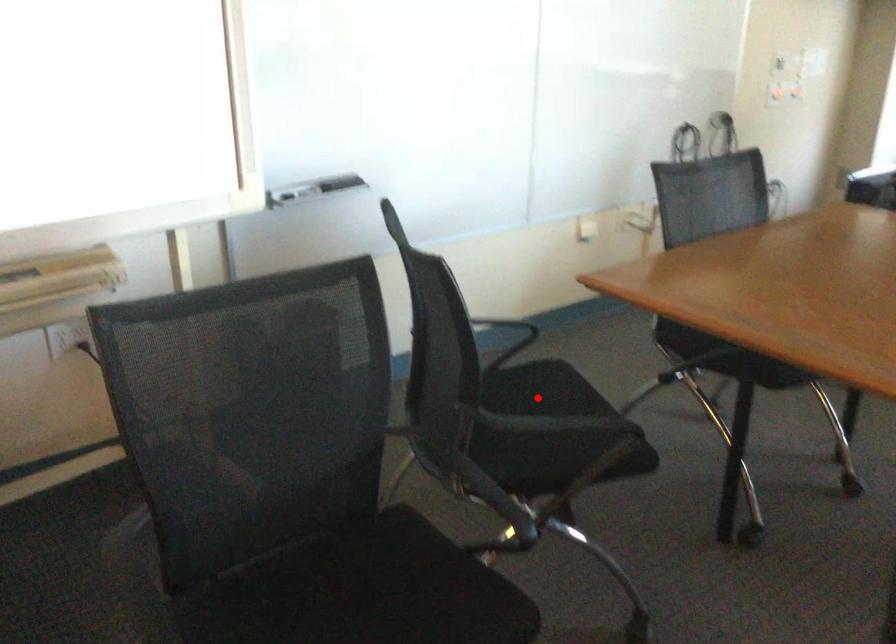
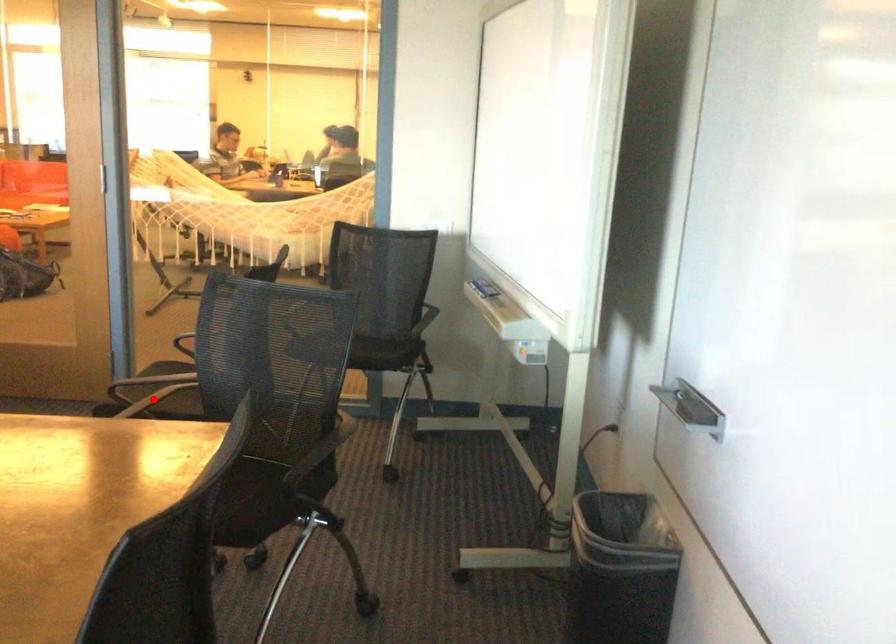
I am providing you with two images of the same scene from different viewpoints. A red point is marked on the first image and another point is marked on the second image. Is the red point in image1 aligned with the point shown in image2?

No